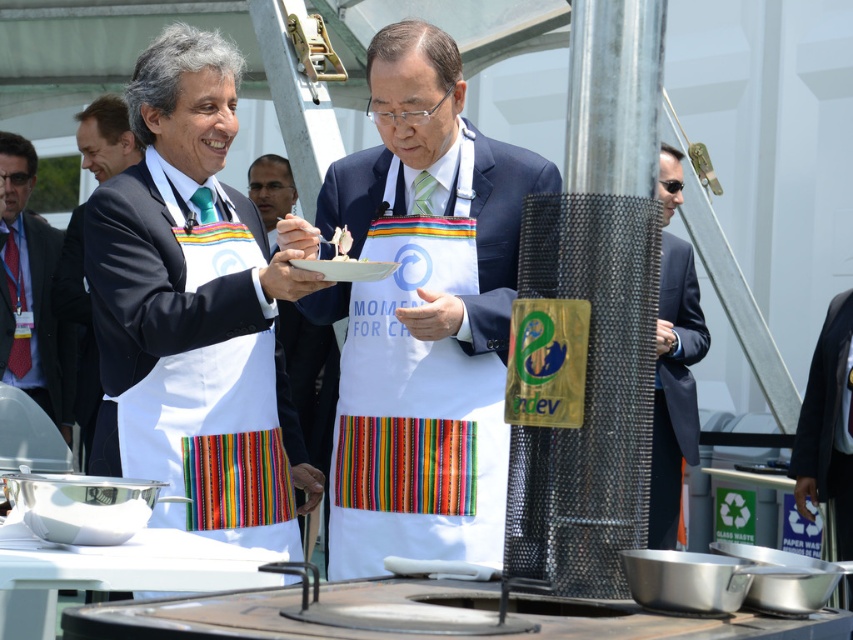
What do you see at coordinates (674, 388) in the screenshot? The height and width of the screenshot is (640, 853). I see `dark blue suit at right` at bounding box center [674, 388].

This screenshot has height=640, width=853. Describe the element at coordinates (674, 388) in the screenshot. I see `dark blue suit at right` at that location.

Find the location of `dark blue suit at right`. dark blue suit at right is located at coordinates (674, 388).

Is point (347, 209) less distant than point (358, 268)?

That is False.

How distant is white apron with colorful stripes at center from white matte platter at center?

white apron with colorful stripes at center is 35.53 centimeters away from white matte platter at center.

Which is in front, point (358, 376) or point (363, 276)?

Point (363, 276) is in front.

Identify the location of white apron with colorful stripes at center. click(x=425, y=294).

Can you confirm if matte white apron at center is shorter than white matte platter at center?

In fact, matte white apron at center may be taller than white matte platter at center.

Who is taller, matte white apron at center or white matte platter at center?

matte white apron at center is taller.

Between point (93, 396) and point (349, 259), which one is positioned in front?

Positioned in front is point (349, 259).

Locate an element on the screen. This screenshot has width=853, height=640. matte white apron at center is located at coordinates (78, 324).